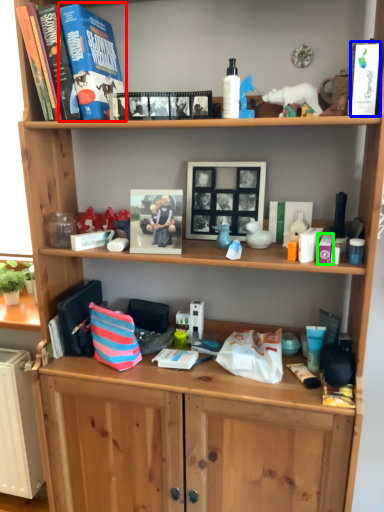
Question: Considering the real-world distances, which object is farthest from paperback book (highlighted by a red box)? paperback book (highlighted by a blue box) or toiletry (highlighted by a green box)?

Choices:
 (A) paperback book
 (B) toiletry

Answer: (B)